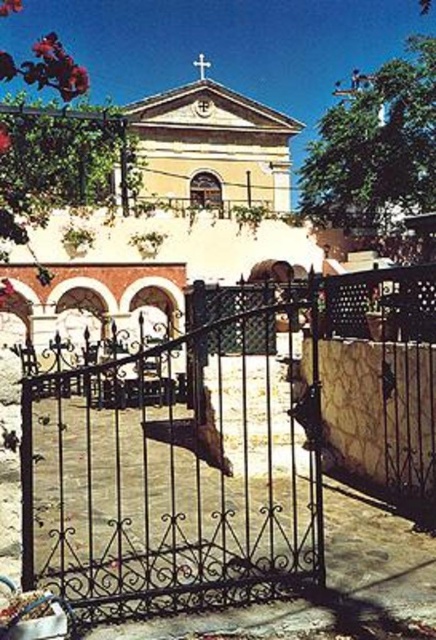
You are standing at the entrance of the church and want to walk towards the wrought iron gate at center. According to the coordinates provided, in which direction should you move relative to your current position?

The wrought iron gate at center is located at coordinates point (224, 445). Since you are at the entrance, which is likely positioned near the front of the church, you should move forward towards the center of the scene to reach the wrought iron gate at center.

You are standing in front of the church and want to enter through the white wooden door at center. Which direction should you move relative to the wrought iron gate at center to reach the door?

You should move to the right of the wrought iron gate at center to reach the white wooden door at center since the wrought iron gate at center is to the left of the white wooden door at center according to the description.